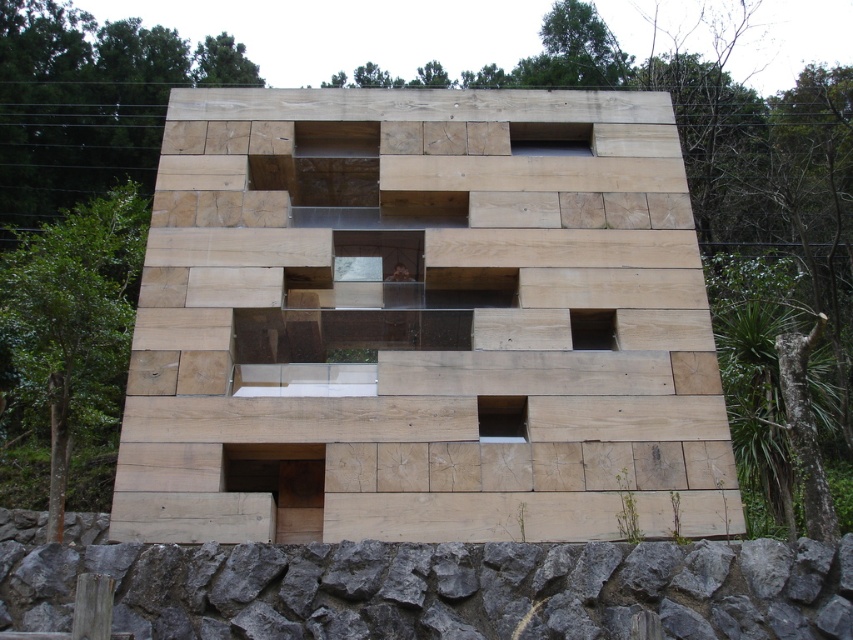
You are an architect designing a new outdoor structure and want to ensure visitors can see both the natural wood plywood at center and the gray rough stone at lower center from the entrance path. Based on their positions, which one will appear closer to visitors as they approach the structure?

The natural wood plywood at center appears closer to visitors because it is positioned further to the viewer than the gray rough stone at lower center, meaning it would be the first element they encounter as they approach the structure.

You are standing in front of the modern wooden structure and want to determine the relative positions of two points marked on the facade. Which of the two points, point 1 at coordinates [663,432] or point 2 at coordinates [387,564], is closer to your viewpoint?

Point 2 at coordinates [387,564] is closer to your viewpoint because it is less further to the camera than point 1 at coordinates [663,432] according to the description.